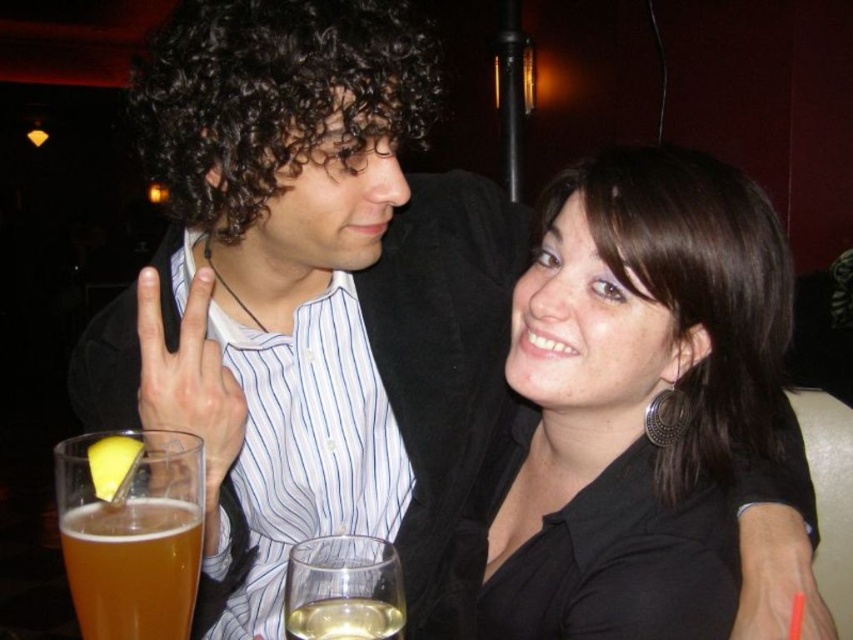
Question: Can you confirm if black matte shirt at center is positioned to the right of translucent glass at lower left?

Choices:
 (A) yes
 (B) no

Answer: (A)

Question: Estimate the real-world distances between objects in this image. Which object is closer to the matte black hand at upper left?

Choices:
 (A) black matte shirt at center
 (B) translucent glass wine at lower center

Answer: (B)

Question: Which of the following is the farthest from the observer?

Choices:
 (A) matte black hand at upper left
 (B) black matte shirt at center
 (C) translucent glass wine at lower center
 (D) translucent glass at lower left

Answer: (B)

Question: Is black matte shirt at center positioned at the back of translucent glass at lower left?

Choices:
 (A) yes
 (B) no

Answer: (A)

Question: Which object appears farthest from the camera in this image?

Choices:
 (A) translucent glass wine at lower center
 (B) matte black hand at upper left

Answer: (B)

Question: Is translucent glass at lower left further to camera compared to translucent glass wine at lower center?

Choices:
 (A) no
 (B) yes

Answer: (A)